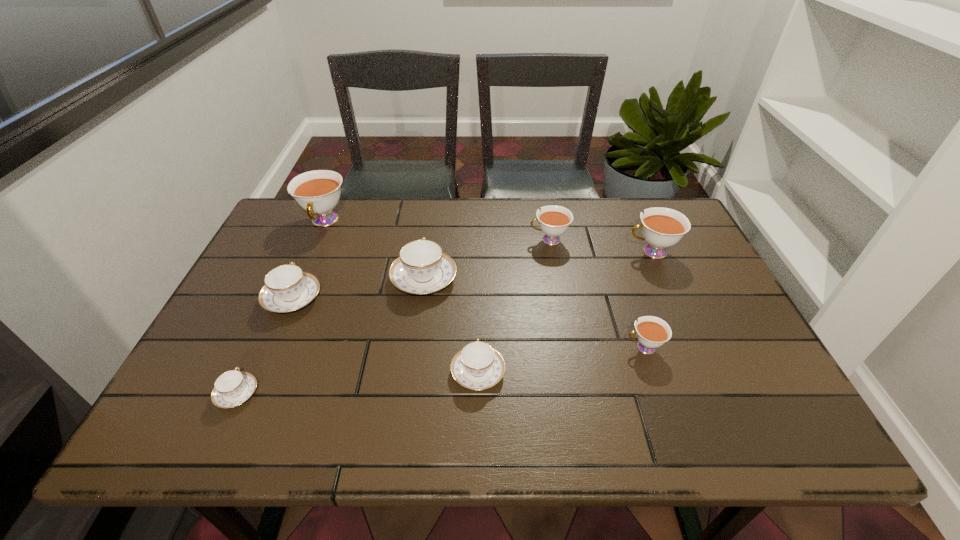
Find the location of a particular element. vacant point located on the side of the second smallest white teacup with the handle is located at coordinates (490, 240).

You are a GUI agent. You are given a task and a screenshot of the screen. Output one action in this format:
    pyautogui.click(x=<x>, y=<y>)
    Task: Click on the vacant point located 0.240m on the side of the second smallest white teacup with the handle
    The image size is (960, 540).
    Given the screenshot: What is the action you would take?
    pyautogui.click(x=449, y=240)

Locate an element on the screen. This screenshot has height=540, width=960. free region located 0.340m on the side with the handle of the third smallest blue teacup is located at coordinates (331, 208).

I want to click on free space located on the side with the handle of the third smallest blue teacup, so click(334, 201).

Locate an element on the screen. This screenshot has width=960, height=540. free space located on the side with the handle of the third smallest blue teacup is located at coordinates (307, 264).

At what (x,y) coordinates should I click in order to perform the action: click on blank space located on the side of the nearest white teacup with the handle. Please return your answer as a coordinate pair (x, y). This screenshot has height=540, width=960. Looking at the image, I should click on (453, 348).

Identify the location of vacant space situated 0.150m on the side of the nearest white teacup with the handle. The width and height of the screenshot is (960, 540). (561, 348).

This screenshot has height=540, width=960. I want to click on free spot located on the side of the nearest white teacup with the handle, so click(474, 348).

You are a GUI agent. You are given a task and a screenshot of the screen. Output one action in this format:
    pyautogui.click(x=<x>, y=<y>)
    Task: Click on the vacant space located on the side with the handle of the second smallest blue teacup
    
    Given the screenshot: What is the action you would take?
    pyautogui.click(x=478, y=309)

Locate an element on the screen. free space located on the side with the handle of the second smallest blue teacup is located at coordinates (478, 272).